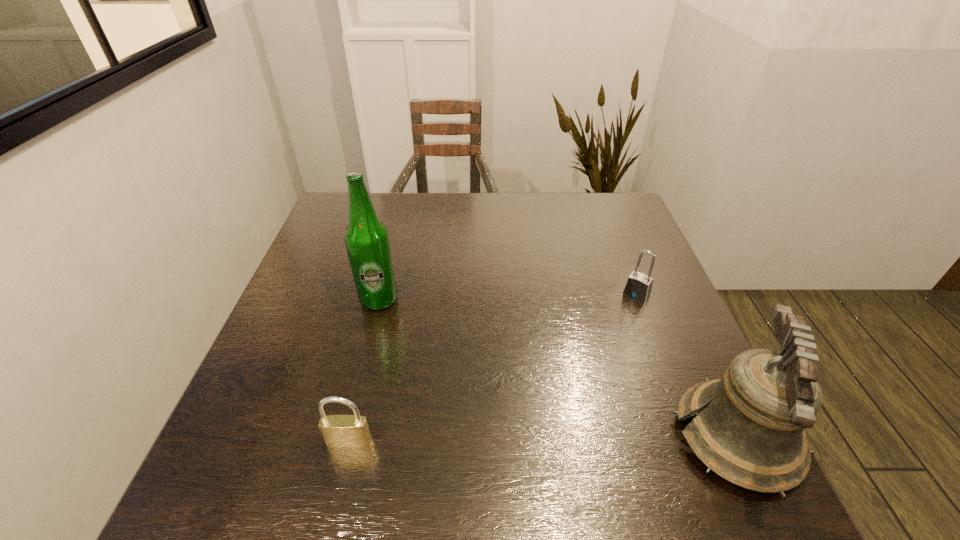
I want to click on vacant space on the desktop that is between the left padlock and the bell and is positioned on the shackle of the right padlock, so click(x=534, y=440).

This screenshot has width=960, height=540. What are the coordinates of `vacant space on the desktop that is between the nearer padlock and the bell and is positioned on the label of the beer bottle` in the screenshot? It's located at (545, 440).